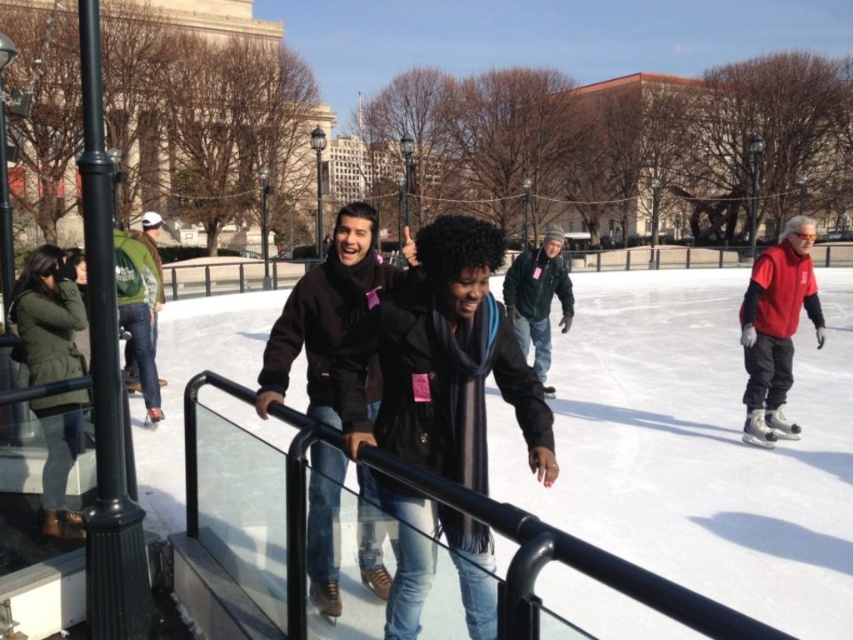
You are standing at the center of the ice skating rink and see two points marked on the ice. The first point is at coordinates point (506, 292) and the second is at point (160, 275). Which point is closer to you?

Point (506, 292) is in front of point (160, 275), so it is closer to you.